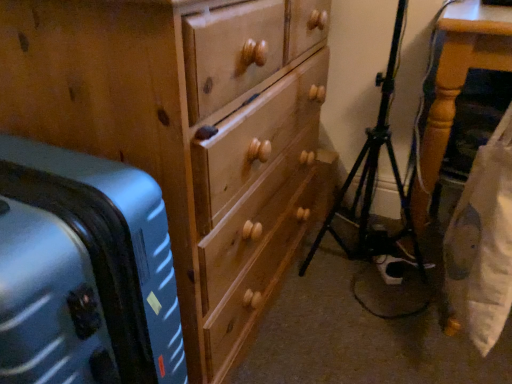
Where is `vacant space underneath black metal tripod at lower right (from a real-world perspective)`? This screenshot has width=512, height=384. vacant space underneath black metal tripod at lower right (from a real-world perspective) is located at coordinates 346,280.